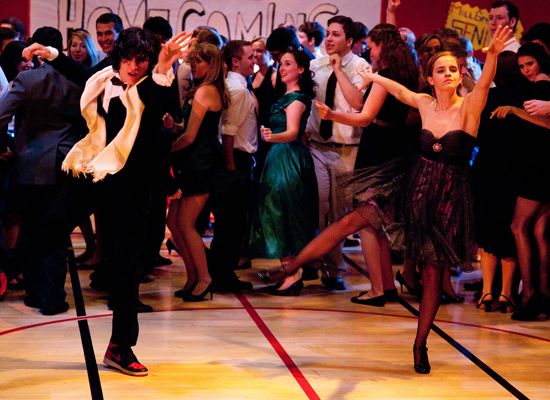
Image resolution: width=550 pixels, height=400 pixels. Find the location of `"homecoming" sign`. "homecoming" sign is located at coordinates (360, 8).